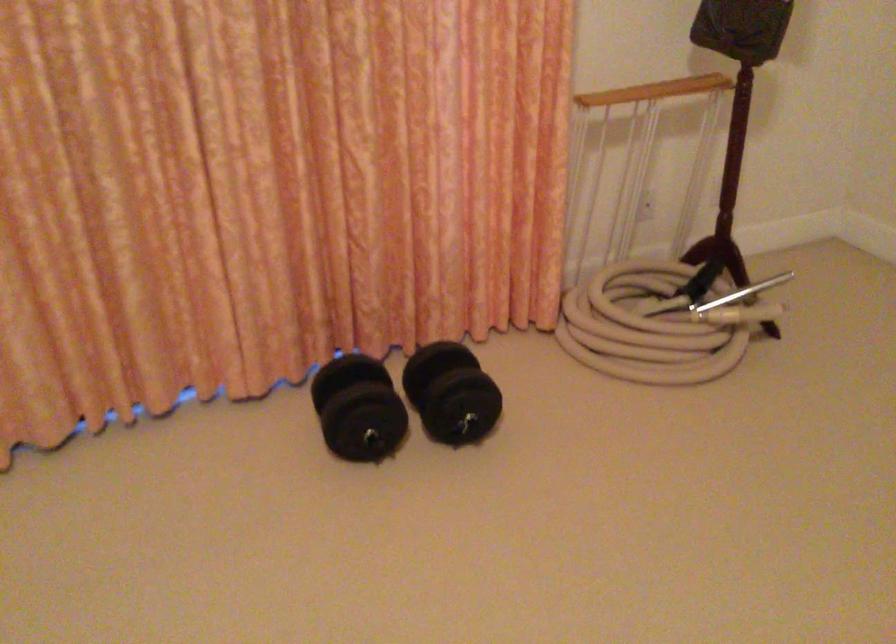
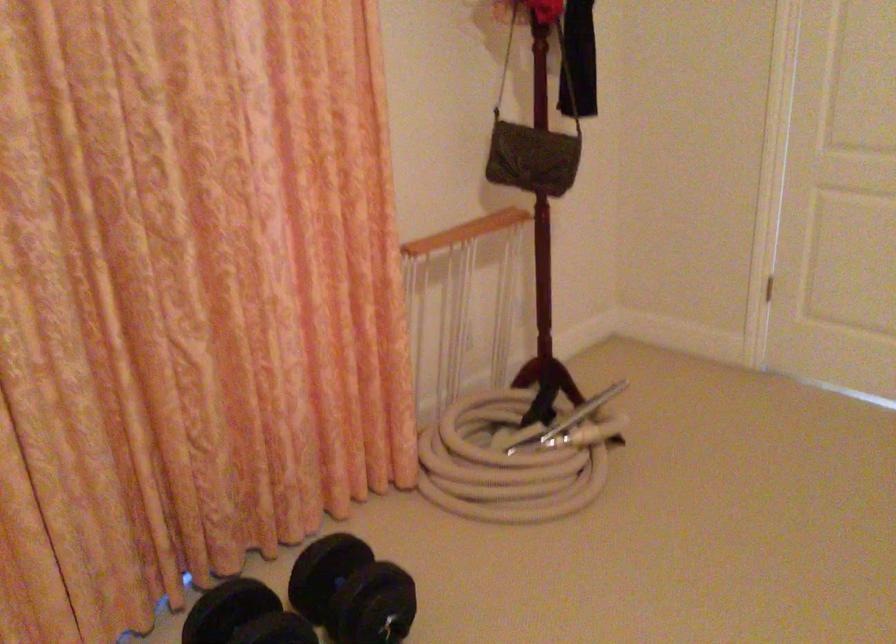
Where in the second image is the point corresponding to pixel 633 324 from the first image?

(503, 466)